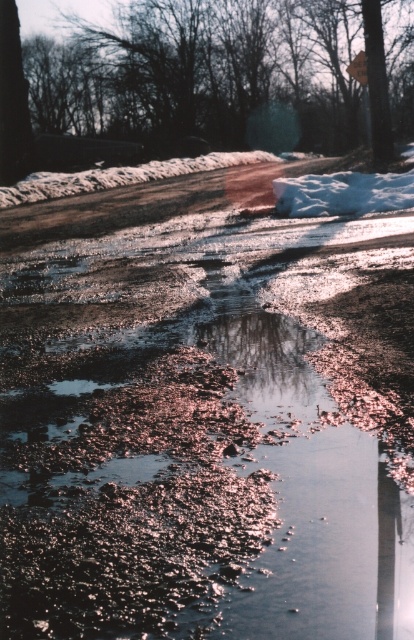
Question: Can you confirm if brown textured tree at upper center is smaller than metallic reflective sign at upper center?

Choices:
 (A) no
 (B) yes

Answer: (A)

Question: Which point is farther from the camera taking this photo?

Choices:
 (A) (351, 68)
 (B) (259, 129)

Answer: (B)

Question: Among these objects, which one is nearest to the camera?

Choices:
 (A) brown textured tree at upper center
 (B) metallic reflective sign at upper center

Answer: (A)

Question: Can you confirm if brown textured tree at upper center is wider than metallic reflective sign at upper center?

Choices:
 (A) no
 (B) yes

Answer: (B)

Question: Can you confirm if brown textured tree at upper center is smaller than metallic reflective sign at upper center?

Choices:
 (A) no
 (B) yes

Answer: (A)